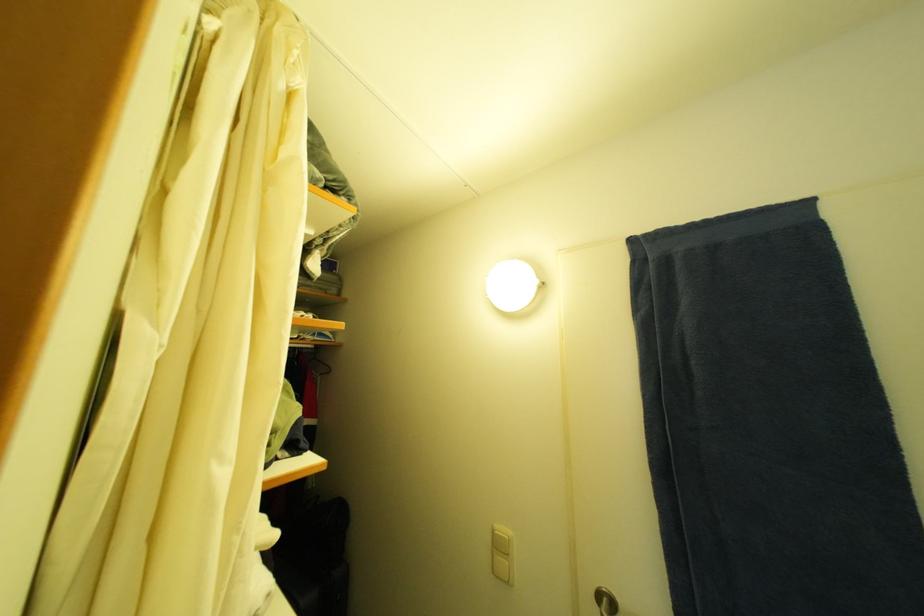
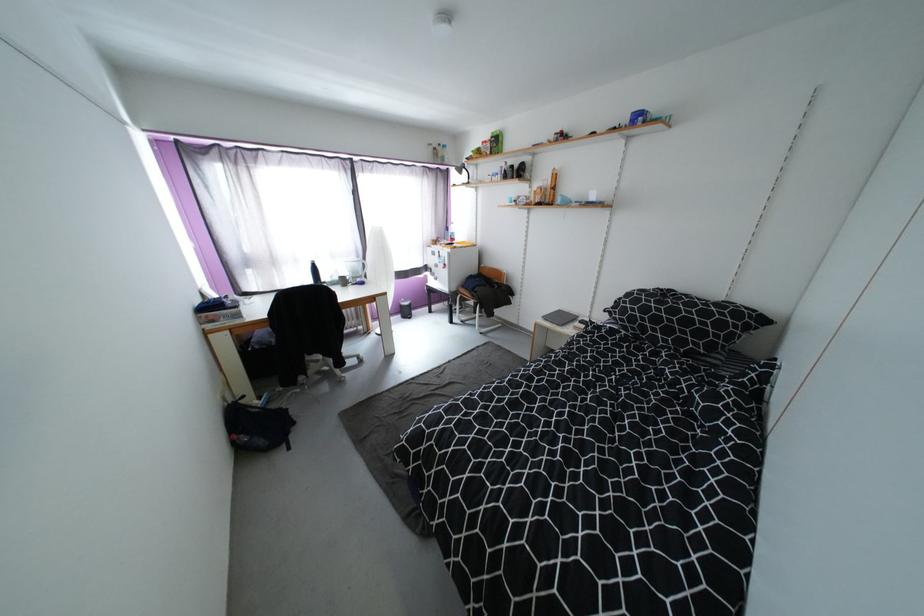
Based on the continuous images, in which direction is the camera rotating?

The camera's rotation is toward left-down.